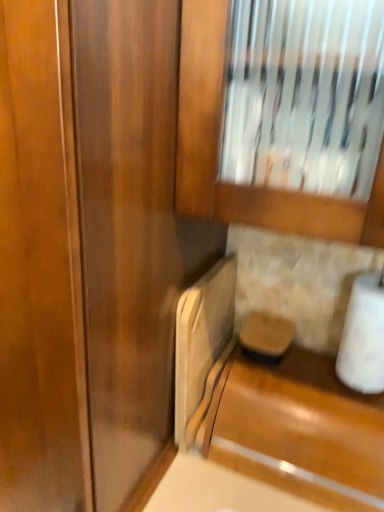
Question: Can you confirm if white matte toilet paper at lower right is smaller than glossy wood cabinet at lower right?

Choices:
 (A) yes
 (B) no

Answer: (A)

Question: Is the depth of white matte toilet paper at lower right greater than that of glossy wood cabinet at lower right?

Choices:
 (A) no
 (B) yes

Answer: (B)

Question: Is white matte toilet paper at lower right beside glossy wood cabinet at lower right?

Choices:
 (A) no
 (B) yes

Answer: (A)

Question: Can you confirm if white matte toilet paper at lower right is wider than glossy wood cabinet at lower right?

Choices:
 (A) no
 (B) yes

Answer: (A)

Question: From the image's perspective, would you say white matte toilet paper at lower right is positioned over glossy wood cabinet at lower right?

Choices:
 (A) yes
 (B) no

Answer: (A)

Question: From the image's perspective, is white matte toilet paper at lower right located beneath glossy wood cabinet at lower right?

Choices:
 (A) no
 (B) yes

Answer: (A)

Question: Is glossy wood cabinet at lower right to the right of white matte toilet paper at lower right from the viewer's perspective?

Choices:
 (A) yes
 (B) no

Answer: (B)

Question: From the image's perspective, is glossy wood cabinet at lower right above white matte toilet paper at lower right?

Choices:
 (A) yes
 (B) no

Answer: (B)

Question: Can you confirm if glossy wood cabinet at lower right is bigger than white matte toilet paper at lower right?

Choices:
 (A) yes
 (B) no

Answer: (A)

Question: From the image's perspective, does glossy wood cabinet at lower right appear lower than white matte toilet paper at lower right?

Choices:
 (A) no
 (B) yes

Answer: (B)

Question: Is glossy wood cabinet at lower right positioned with its back to white matte toilet paper at lower right?

Choices:
 (A) yes
 (B) no

Answer: (B)

Question: Is glossy wood cabinet at lower right further to the viewer compared to white matte toilet paper at lower right?

Choices:
 (A) no
 (B) yes

Answer: (A)

Question: Considering the positions of white matte toilet paper at lower right and glossy wood cabinet at lower right in the image, is white matte toilet paper at lower right bigger or smaller than glossy wood cabinet at lower right?

Choices:
 (A) big
 (B) small

Answer: (B)